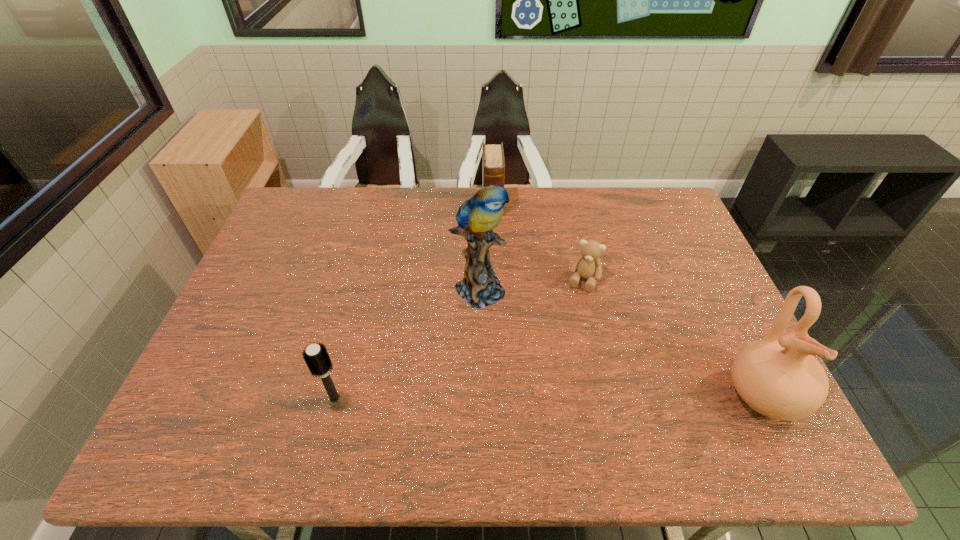
You are a GUI agent. You are given a task and a screenshot of the screen. Output one action in this format:
    pyautogui.click(x=<x>, y=<y>)
    Task: Click on the empty space that is in between the fourth shortest object and the leftmost object
    
    Given the screenshot: What is the action you would take?
    pyautogui.click(x=549, y=397)

What are the coordinates of `empty location between the farthest object and the fourth object from left to right` in the screenshot? It's located at (538, 242).

The height and width of the screenshot is (540, 960). What are the coordinates of `empty space that is in between the farthest object and the hairbrush` in the screenshot? It's located at (414, 301).

Find the location of `free space between the leftmost object and the farthest object`. free space between the leftmost object and the farthest object is located at coordinates (414, 301).

Find the location of `vacant space that's between the hairbrush and the parrot`. vacant space that's between the hairbrush and the parrot is located at coordinates (407, 342).

What are the coordinates of `free space that is in between the leftmost object and the pottery` in the screenshot? It's located at (549, 397).

Identify the location of the fourth closest object relative to the diary. The image size is (960, 540). (777, 376).

Image resolution: width=960 pixels, height=540 pixels. Find the location of `object that is the second nearest to the tallest object`. object that is the second nearest to the tallest object is located at coordinates (493, 173).